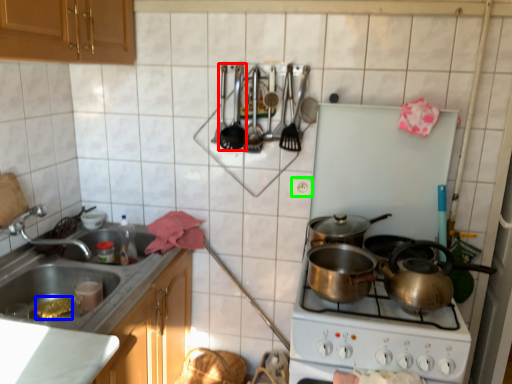
Question: Which object is the closest to the appliance (highlighted by a red box)? Choose among these: food (highlighted by a blue box) or electric outlet (highlighted by a green box).

Choices:
 (A) food
 (B) electric outlet

Answer: (B)